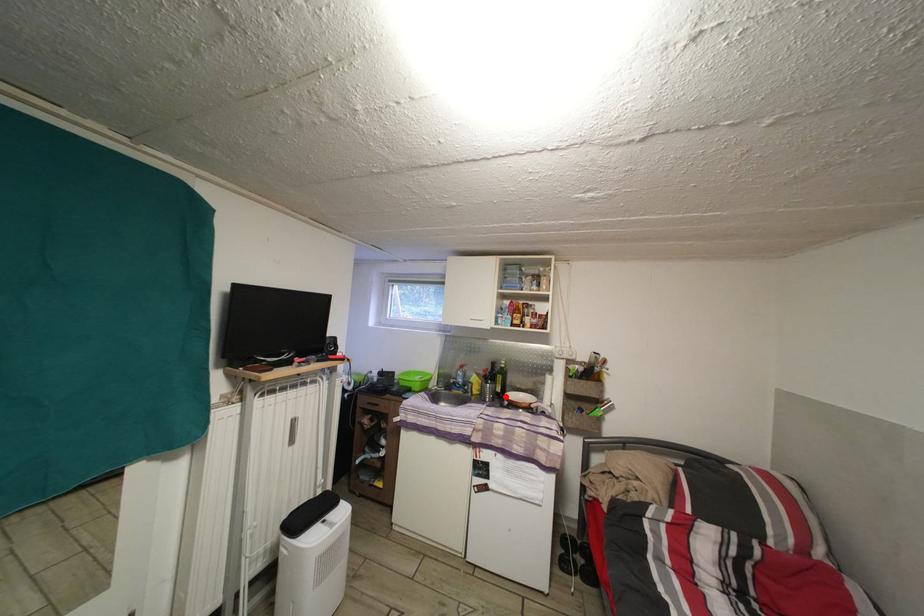
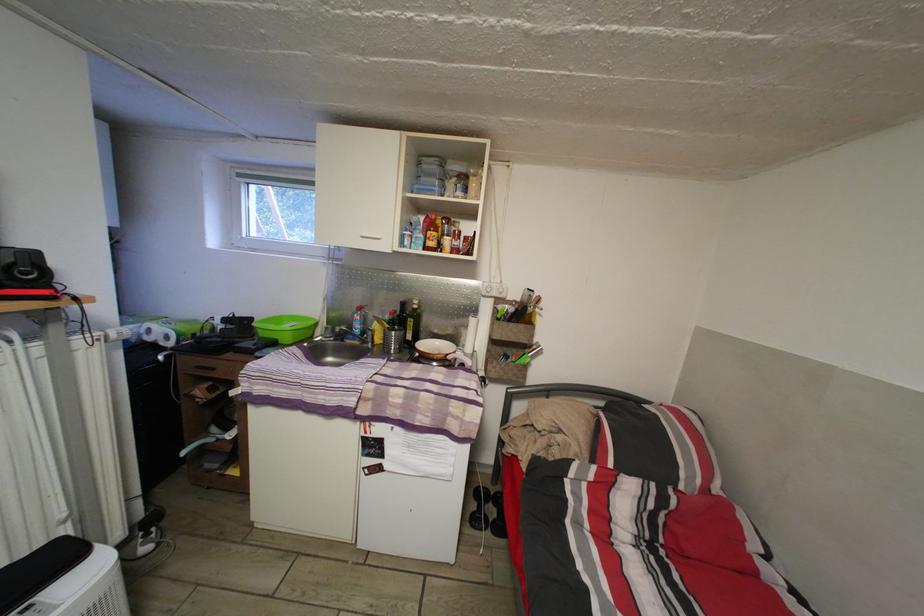
The point at the highlighted location is marked in the first image. Where is the corresponding point in the second image?

(417, 344)